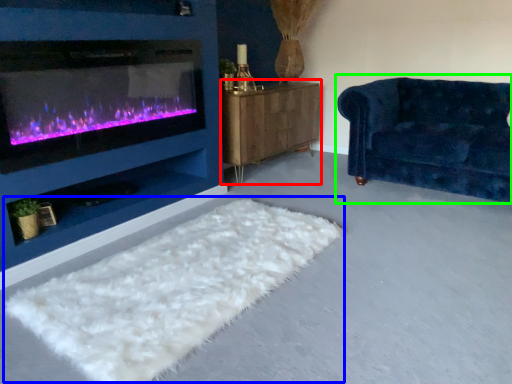
Question: Estimate the real-world distances between objects in this image. Which object is farther from dresser (highlighted by a red box), mat (highlighted by a blue box) or studio couch (highlighted by a green box)?

Choices:
 (A) mat
 (B) studio couch

Answer: (A)